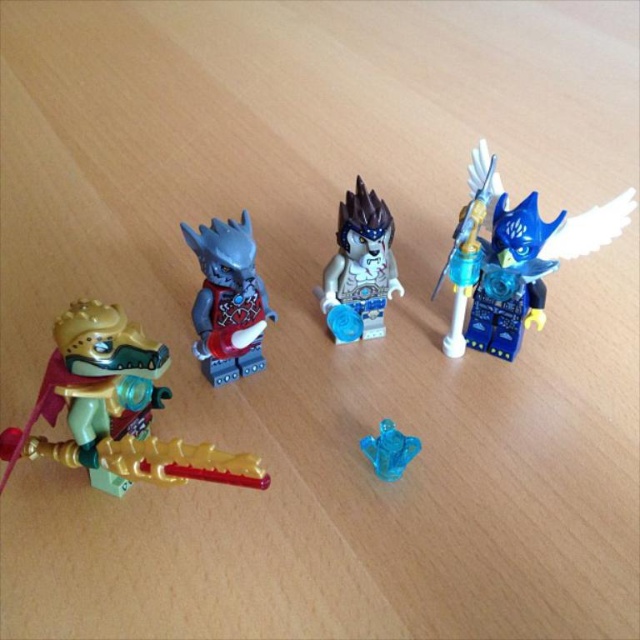
Between point (532, 205) and point (358, 269), which one is positioned behind?

Point (358, 269)

Who is more distant from viewer, [480,189] or [376,252]?

The point [376,252] is more distant.

You are a GUI agent. You are given a task and a screenshot of the screen. Output one action in this format:
    pyautogui.click(x=<x>, y=<y>)
    Task: Click on the blue translucent figure at upper right
    Image resolution: width=640 pixels, height=640 pixels.
    Given the screenshot: What is the action you would take?
    pyautogui.click(x=513, y=259)

Is gold metallic dragon at lower left above white glossy minifigure at center?

No.

Does point (140, 365) come behind point (355, 244)?

No, (140, 365) is in front of (355, 244).

Is point (147, 385) closer to viewer compared to point (371, 289)?

That is True.

This screenshot has width=640, height=640. I want to click on gold metallic dragon at lower left, so click(115, 410).

Can you confirm if matte gray minifigure at center is thinner than transparent blue gemstone at center?

No, matte gray minifigure at center is not thinner than transparent blue gemstone at center.

Who is taller, matte gray minifigure at center or transparent blue gemstone at center?

matte gray minifigure at center

Between point (250, 236) and point (378, 449), which one is positioned in front?

Positioned in front is point (378, 449).

In order to click on matte gray minifigure at center in this screenshot , I will do pyautogui.click(x=227, y=300).